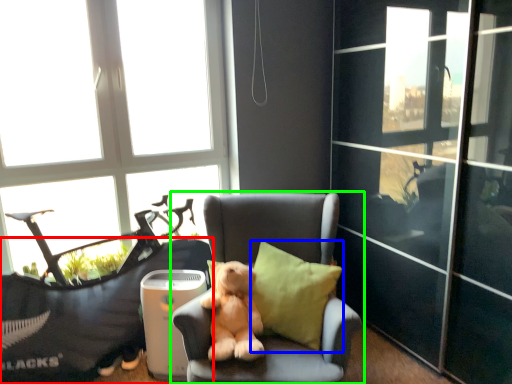
Question: Considering the real-world distances, which object is farthest from furniture (highlighted by a red box)? pillow (highlighted by a blue box) or chair (highlighted by a green box)?

Choices:
 (A) pillow
 (B) chair

Answer: (A)